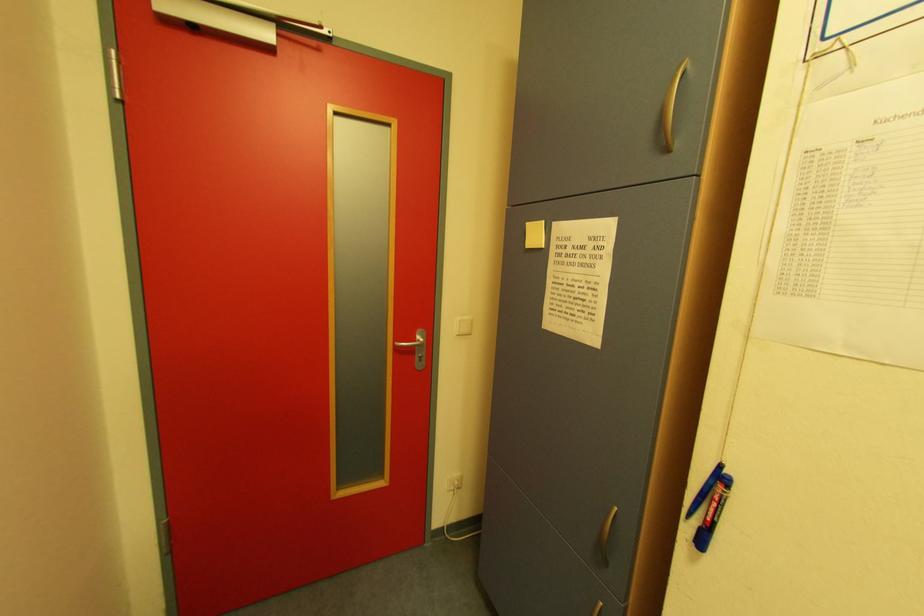
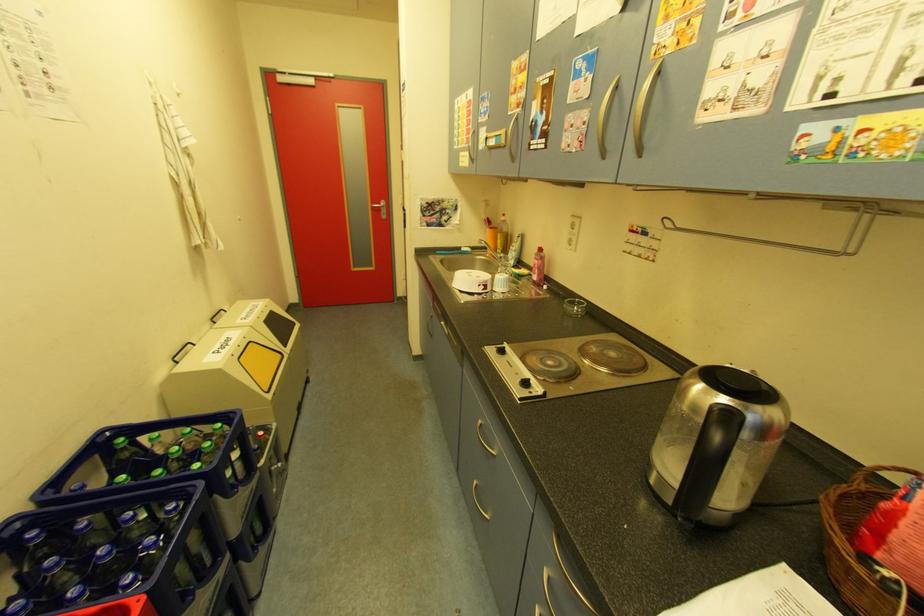
Which direction would the cameraman need to move to produce the second image?

The movement direction of the cameraman is right, backward.